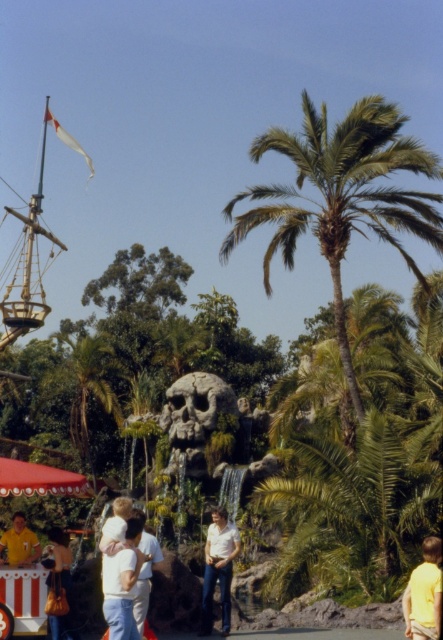
Question: Considering the real-world distances, which object is farthest from the white shirt at center?

Choices:
 (A) green leafy palm tree at center
 (B) yellow matte shirt at lower left
 (C) white cotton shirt at lower left
 (D) matte white shirt at lower left

Answer: (A)

Question: Can you confirm if matte white shirt at lower left is positioned to the left of yellow matte shirt at lower left?

Choices:
 (A) no
 (B) yes

Answer: (A)

Question: Which point appears farthest from the camera in this image?

Choices:
 (A) (206, 560)
 (B) (30, 532)
 (C) (90, 365)

Answer: (C)

Question: Is white cotton shirt at lower left thinner than yellow matte shirt at lower left?

Choices:
 (A) yes
 (B) no

Answer: (A)

Question: Which point is closer to the camera?

Choices:
 (A) green leafy palm tree at center
 (B) matte white shirt at lower left
 (C) yellow matte shirt at lower right

Answer: (C)

Question: Does green leafy palm tree at center-right have a smaller size compared to white cotton shirt at lower left?

Choices:
 (A) no
 (B) yes

Answer: (A)